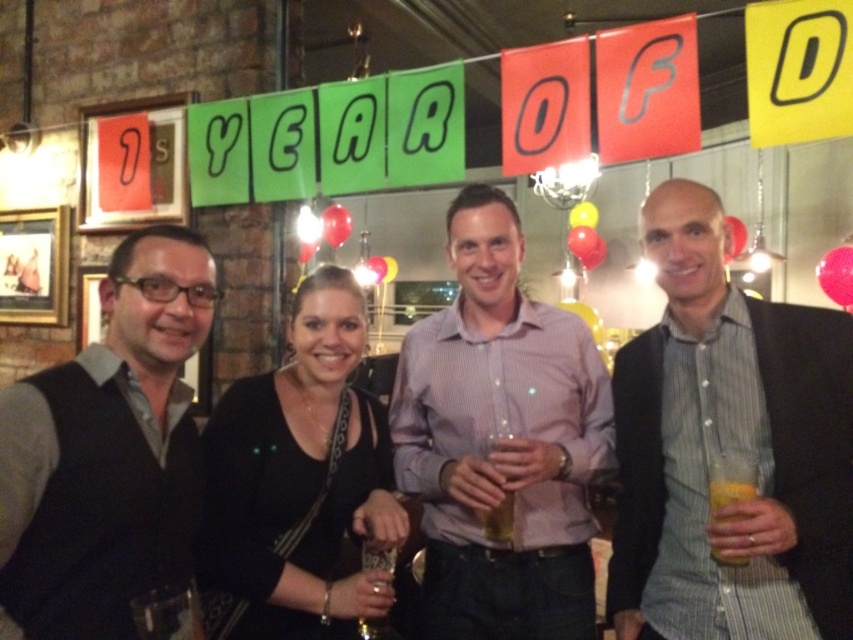
You are at a party and want to place a new drink on the table next to the dark gray sweater vest at left and the translucent plastic cup at right. Which object should you place it next to if you want to leave more space for other items?

You should place the new drink next to the dark gray sweater vest at left because it is smaller than the translucent plastic cup at right, allowing more space for other items.

You are at a party and want to find the purple striped shirt at center. You see the dark gray sweater vest at left. Which one is lower in the image?

The purple striped shirt at center is located below the dark gray sweater vest at left, so the purple striped shirt at center is lower in the image.